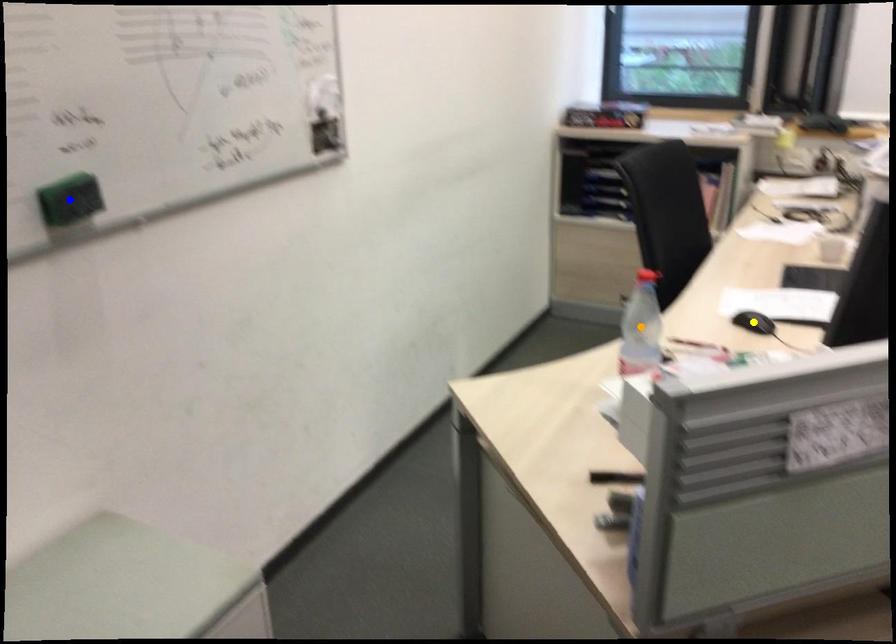
Order these from nearest to farthest:
A) yellow point
B) orange point
C) blue point

blue point < orange point < yellow point